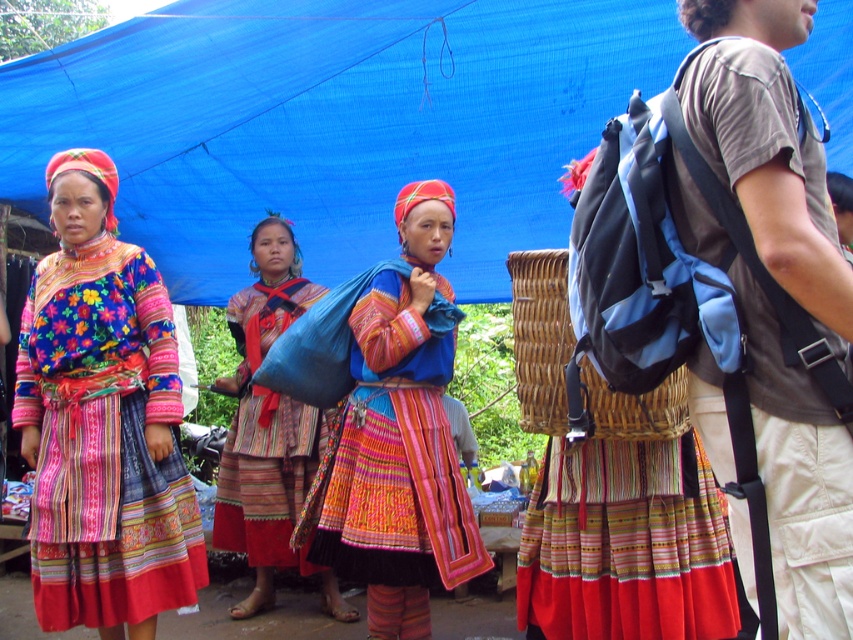
Question: Which object is positioned farthest from the multicolored woven skirt at center?

Choices:
 (A) multicolored woven skirt at left
 (B) textured woven bag at center
 (C) brown cotton shirt at right
 (D) woven brown basket at center

Answer: (C)

Question: Can you confirm if textured woven bag at center is positioned below woven brown basket at center?

Choices:
 (A) no
 (B) yes

Answer: (B)

Question: Where is multicolored woven skirt at center located in relation to woven brown basket at center in the image?

Choices:
 (A) right
 (B) left

Answer: (B)

Question: Which is nearer to the woven brown basket at center?

Choices:
 (A) multicolored woven skirt at left
 (B) multicolored woven skirt at center
 (C) blue fabric canopy at upper center
 (D) textured woven bag at center

Answer: (B)

Question: Which point is closer to the camera?

Choices:
 (A) woven brown basket at center
 (B) multicolored woven skirt at left

Answer: (A)

Question: Can you confirm if brown cotton shirt at right is thinner than multicolored woven skirt at left?

Choices:
 (A) no
 (B) yes

Answer: (B)